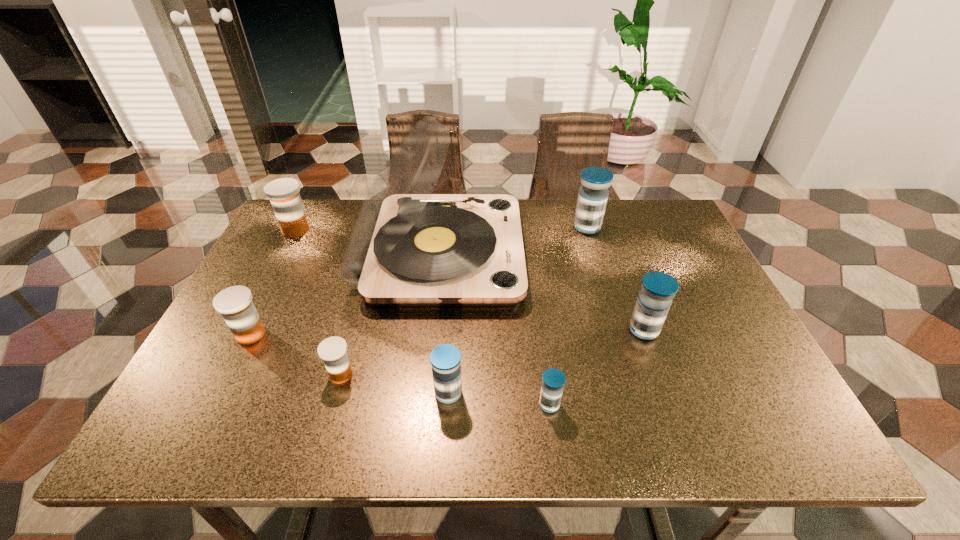
At what (x,y) coordinates should I click in order to perform the action: click on the third object from right to left. Please return your answer as a coordinate pair (x, y). Looking at the image, I should click on tap(553, 380).

Where is `the third medicine from right to left`? The width and height of the screenshot is (960, 540). the third medicine from right to left is located at coordinates (553, 380).

The height and width of the screenshot is (540, 960). Find the location of `vacant area situated 0.130m with the tonearm facing the front of the tallest object`. vacant area situated 0.130m with the tonearm facing the front of the tallest object is located at coordinates (567, 253).

Find the location of `free spot located on the front of the tallest medicine`. free spot located on the front of the tallest medicine is located at coordinates (606, 287).

Find the location of a particular element. This screenshot has height=540, width=960. free space located 0.380m on the label of the biggest orange medicine is located at coordinates (438, 230).

Identify the location of free space located 0.070m on the back of the second farthest blue medicine. (633, 298).

I want to click on free space located 0.390m on the label of the second smallest orange medicine, so (x=435, y=335).

Where is `vacant space located 0.160m on the back of the leftmost blue medicine`? vacant space located 0.160m on the back of the leftmost blue medicine is located at coordinates (452, 324).

This screenshot has height=540, width=960. I want to click on vacant space located 0.100m on the label of the fifth medicine from right to left, so click(325, 430).

Where is `vacant space located on the back of the smallest blue medicine`? vacant space located on the back of the smallest blue medicine is located at coordinates (531, 267).